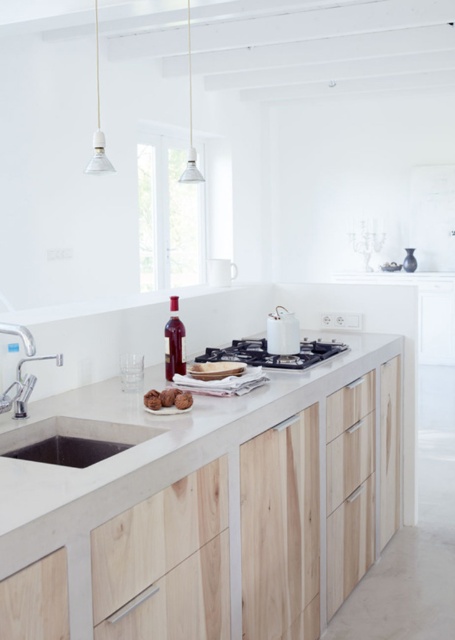
Between concrete/wooden counter top at center and matte white sink at lower left, which one is positioned higher?

matte white sink at lower left is above.

Where is `concrete/wooden counter top at center`? The height and width of the screenshot is (640, 455). concrete/wooden counter top at center is located at coordinates (203, 506).

Which is in front, point (45, 420) or point (84, 452)?

Positioned in front is point (84, 452).

Identify the location of concrete/wooden counter top at center. (203, 506).

Does matte concrete sink at lower left have a greater height compared to brown matte muffins at center?

Yes, matte concrete sink at lower left is taller than brown matte muffins at center.

In order to click on matte concrete sink at lower left in this screenshot , I will do `click(71, 440)`.

I want to click on matte concrete sink at lower left, so click(71, 440).

At what (x,y) coordinates should I click in order to perform the action: click on matte concrete sink at lower left. Please return your answer as a coordinate pair (x, y). The width and height of the screenshot is (455, 640). Looking at the image, I should click on (71, 440).

Find the location of a particular element. matte concrete sink at lower left is located at coordinates (71, 440).

Is matte concrete sink at lower left bigger than brushed metal faucet at lower left?

Indeed, matte concrete sink at lower left has a larger size compared to brushed metal faucet at lower left.

Who is more forward, (x=79, y=460) or (x=6, y=403)?

Point (x=6, y=403)

This screenshot has height=640, width=455. Find the location of `matte concrete sink at lower left`. matte concrete sink at lower left is located at coordinates (71, 440).